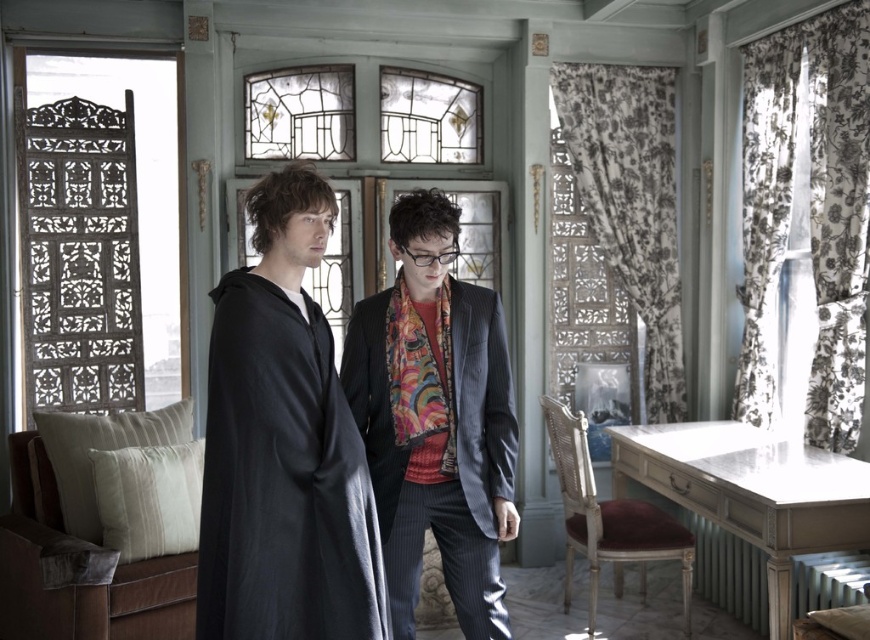
In the scene shown: Does matte black cloak at center have a larger size compared to velvet scarf at center?

Actually, matte black cloak at center might be smaller than velvet scarf at center.

Who is more distant from viewer, (280, 515) or (485, 442)?

Point (485, 442)

Where is `matte black cloak at center`? matte black cloak at center is located at coordinates tap(283, 445).